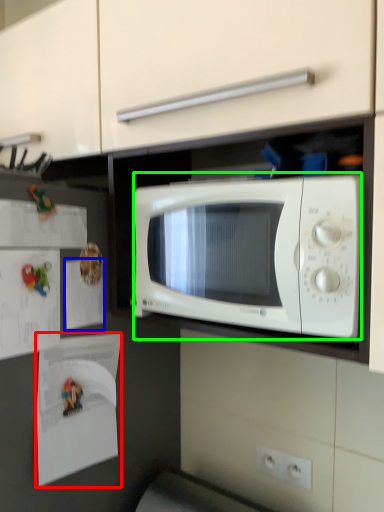
Question: Which object is the farthest from paper (highlighted by a red box)? Choose among these: paper (highlighted by a blue box) or microwave oven (highlighted by a green box).

Choices:
 (A) paper
 (B) microwave oven

Answer: (B)